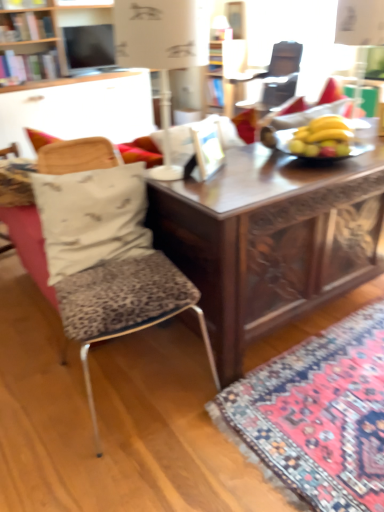
Image resolution: width=384 pixels, height=512 pixels. Find the location of `free space in front of leopard print fabric chair at left`. free space in front of leopard print fabric chair at left is located at coordinates (132, 468).